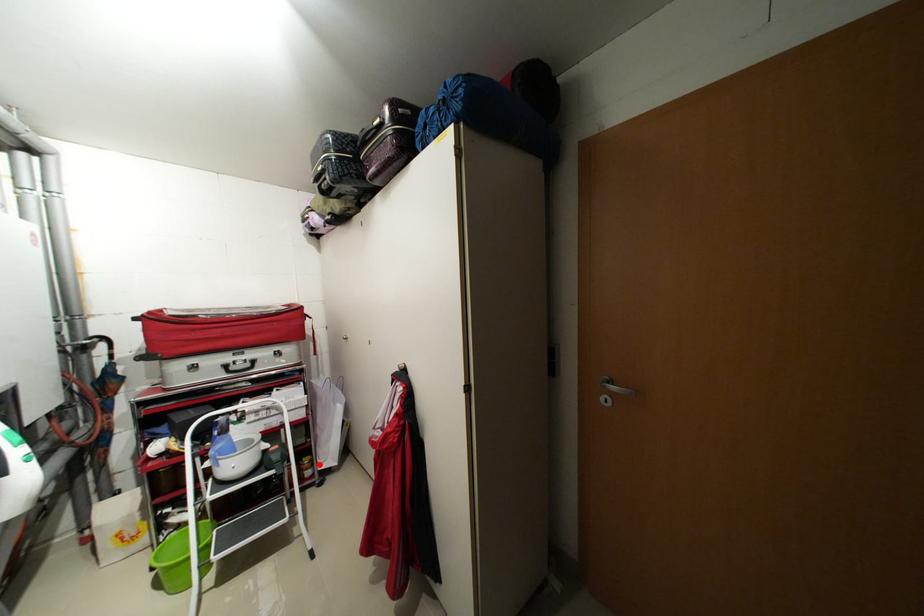
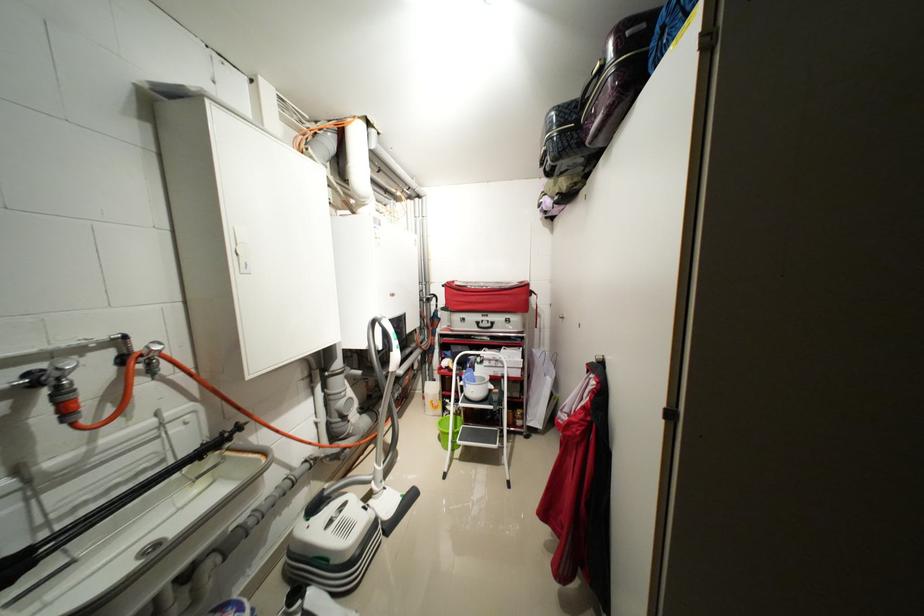
Where in the second image is the point corresponding to the highlighted location from the first image?

(530, 418)